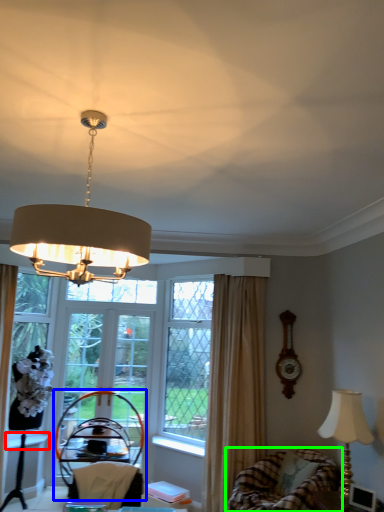
Question: Based on their relative distances, which object is nearer to window sill (highlighted by a red box)? Choose from armchair (highlighted by a blue box) and swivel chair (highlighted by a green box).

Choices:
 (A) armchair
 (B) swivel chair

Answer: (A)